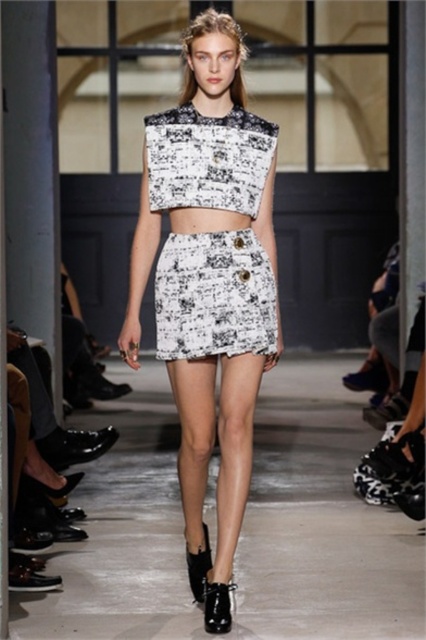
Question: Which object appears closest to the camera in this image?

Choices:
 (A) white printed fabric skirt at center
 (B) white printed fabric dress at center

Answer: (A)

Question: Which object is farther from the camera taking this photo?

Choices:
 (A) white printed fabric skirt at center
 (B) white printed fabric dress at center

Answer: (B)

Question: Can you confirm if white printed fabric skirt at center is smaller than white printed fabric dress at center?

Choices:
 (A) yes
 (B) no

Answer: (B)

Question: Which point is closer to the camera taking this photo?

Choices:
 (A) (176, 376)
 (B) (224, 192)

Answer: (B)

Question: In this image, where is white printed fabric skirt at center located relative to white printed fabric dress at center?

Choices:
 (A) left
 (B) right

Answer: (A)

Question: Can you confirm if white printed fabric skirt at center is positioned above white printed fabric dress at center?

Choices:
 (A) yes
 (B) no

Answer: (B)